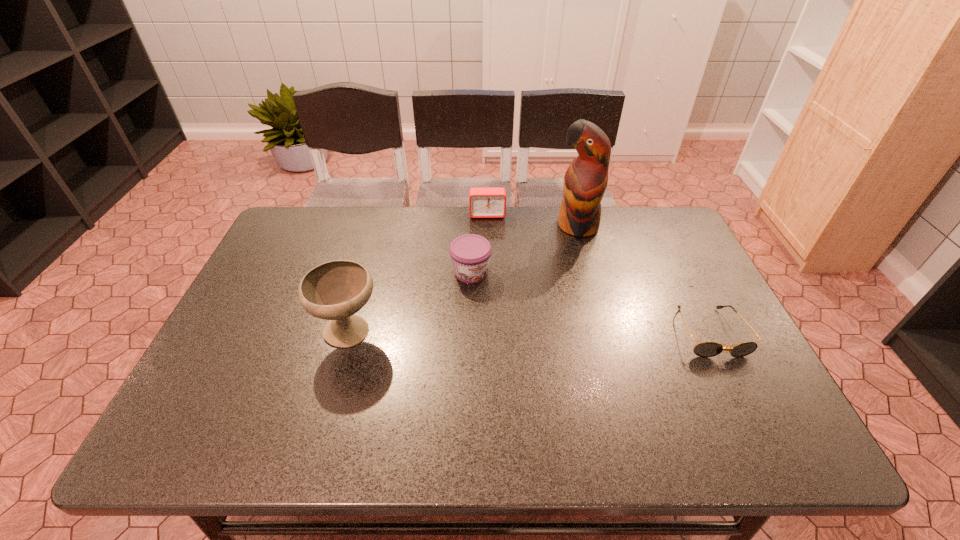
Find the location of a particular element. The width and height of the screenshot is (960, 540). vacant space on the desktop that is between the chalice and the sunglasses and is positioned on the front label of the third farthest object is located at coordinates (516, 333).

You are a GUI agent. You are given a task and a screenshot of the screen. Output one action in this format:
    pyautogui.click(x=<x>, y=<y>)
    Task: Click on the vacant space on the desktop that is between the leftmost object and the shortest object and is positioned on the front-facing side of the alarm clock
    This screenshot has width=960, height=540.
    Given the screenshot: What is the action you would take?
    pyautogui.click(x=492, y=333)

At what (x,y) coordinates should I click in order to perform the action: click on free spot on the desktop that is between the chalice and the rightmost object and is positioned on the face of the tallest object. Please return your answer as a coordinate pair (x, y). The image size is (960, 540). Looking at the image, I should click on (508, 333).